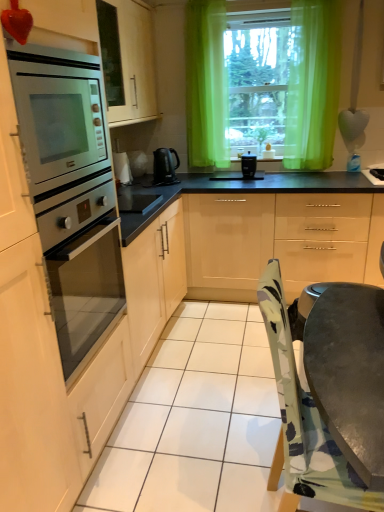
Locate an element on the screen. black plastic kettle at center is located at coordinates (165, 166).

This screenshot has height=512, width=384. Describe the element at coordinates (263, 83) in the screenshot. I see `green sheer curtains at upper center` at that location.

Describe the element at coordinates (279, 241) in the screenshot. I see `glossy beige cabinets at center` at that location.

The width and height of the screenshot is (384, 512). Identify the location of black plastic coffee maker at center. (248, 165).

The height and width of the screenshot is (512, 384). I want to click on black plastic kettle at center, so [x=165, y=166].

In terms of height, does black plastic coffee maker at center look taller or shorter compared to glossy beige cabinets at center?

black plastic coffee maker at center is shorter than glossy beige cabinets at center.

Considering the sizes of objects black plastic coffee maker at center and glossy beige cabinets at center in the image provided, who is wider, black plastic coffee maker at center or glossy beige cabinets at center?

glossy beige cabinets at center is wider.

Between black plastic coffee maker at center and glossy beige cabinets at center, which one appears on the left side from the viewer's perspective?

black plastic coffee maker at center is more to the left.

Is black plastic coffee maker at center looking in the opposite direction of glossy beige cabinets at center?

No, black plastic coffee maker at center is not facing the opposite direction of glossy beige cabinets at center.

At what (x,y) coordinates should I click in order to perform the action: click on home appliance above the glossy beige cabinets at center (from a real-world perspective). Please return your answer as a coordinate pair (x, y). This screenshot has height=512, width=384. Looking at the image, I should click on (165, 166).

Which is behind, glossy beige cabinets at center or black plastic kettle at center?

black plastic kettle at center is more distant.

Which of these two, glossy beige cabinets at center or black plastic kettle at center, is wider?

glossy beige cabinets at center is wider.

Considering the sizes of stainless steel oven at left and black plastic coffee maker at center in the image, is stainless steel oven at left taller or shorter than black plastic coffee maker at center?

Clearly, stainless steel oven at left is taller compared to black plastic coffee maker at center.

Is stainless steel oven at left wider or thinner than black plastic coffee maker at center?

→ Clearly, stainless steel oven at left has more width compared to black plastic coffee maker at center.

From the image's perspective, between stainless steel oven at left and black plastic coffee maker at center, which one is located above?

black plastic coffee maker at center.

Is black plastic coffee maker at center at the back of stainless steel oven at left?

No, stainless steel oven at left's orientation is not away from black plastic coffee maker at center.

Is glossy beige cabinets at center positioned far away from green sheer curtains at upper center?

No, glossy beige cabinets at center is in close proximity to green sheer curtains at upper center.

Measure the distance between glossy beige cabinets at center and green sheer curtains at upper center.

The distance of glossy beige cabinets at center from green sheer curtains at upper center is 32.88 inches.

Between glossy beige cabinets at center and green sheer curtains at upper center, which one appears on the left side from the viewer's perspective?

From the viewer's perspective, green sheer curtains at upper center appears more on the left side.

Considering the sizes of objects glossy beige cabinets at center and green sheer curtains at upper center in the image provided, who is wider, glossy beige cabinets at center or green sheer curtains at upper center?

glossy beige cabinets at center.

From the image's perspective, is black plastic coffee maker at center under green sheer curtains at upper center?

Indeed, from the image's perspective, black plastic coffee maker at center is shown beneath green sheer curtains at upper center.

Is black plastic coffee maker at center positioned beyond the bounds of green sheer curtains at upper center?

black plastic coffee maker at center is positioned outside green sheer curtains at upper center.

Between black plastic coffee maker at center and green sheer curtains at upper center, which one has larger width?

green sheer curtains at upper center.

Where is `window above the black plastic coffee maker at center (from a real-world perspective)`? Image resolution: width=384 pixels, height=512 pixels. window above the black plastic coffee maker at center (from a real-world perspective) is located at coordinates (263, 83).

Is black glass cooktop at center next to black plastic kettle at center and touching it?

No, black glass cooktop at center is not with black plastic kettle at center.

From a real-world perspective, which object stands above the other?

From a 3D spatial view, black plastic kettle at center is above.

Does point (146, 199) come in front of point (168, 162)?

That is True.

Is black glass cooktop at center at the left side of black plastic kettle at center?

Yes.

Can you tell me how much glossy beige cabinets at center and stainless steel oven at left differ in facing direction?

The facing directions of glossy beige cabinets at center and stainless steel oven at left are 91.4 degrees apart.

Is glossy beige cabinets at center not inside stainless steel oven at left?

glossy beige cabinets at center lies outside stainless steel oven at left's area.

Where is `cabinetry that appears behind the stainless steel oven at left`? The image size is (384, 512). cabinetry that appears behind the stainless steel oven at left is located at coordinates (279, 241).

Where is `cabinetry to the right of black plastic coffee maker at center`? cabinetry to the right of black plastic coffee maker at center is located at coordinates (279, 241).

Identify the location of cabinetry located underneath the black plastic kettle at center (from a real-world perspective). (279, 241).

From the image, which object appears to be nearer to green sheer curtains at upper center, stainless steel oven at left or black plastic coffee maker at center?

black plastic coffee maker at center is positioned closer to the anchor green sheer curtains at upper center.

Which object lies further to the anchor point green sheer curtains at upper center, black plastic kettle at center or black glass cooktop at center?

black glass cooktop at center.

Which object lies nearer to the anchor point green sheer curtains at upper center, black glass cooktop at center or stainless steel oven at left?

The object closer to green sheer curtains at upper center is black glass cooktop at center.

Considering their positions, is green sheer curtains at upper center positioned further to black plastic kettle at center than black glass cooktop at center?

The object further to black plastic kettle at center is green sheer curtains at upper center.

Estimate the real-world distances between objects in this image. Which object is closer to black glass cooktop at center, green sheer curtains at upper center or stainless steel oven at left?

The object closer to black glass cooktop at center is stainless steel oven at left.

Considering their positions, is black plastic kettle at center positioned closer to glossy beige cabinets at center than green sheer curtain at upper center?

Among the two, black plastic kettle at center is located nearer to glossy beige cabinets at center.

Considering their positions, is glossy beige cabinets at center positioned closer to green sheer curtains at upper center than stainless steel oven at left?

The object closer to green sheer curtains at upper center is glossy beige cabinets at center.

From the image, which object appears to be nearer to stainless steel oven at left, black plastic kettle at center or black glass cooktop at center?

black glass cooktop at center is positioned closer to the anchor stainless steel oven at left.

Where is `appliance between stainless steel oven at left and black plastic coffee maker at center in the front-back direction`? The width and height of the screenshot is (384, 512). appliance between stainless steel oven at left and black plastic coffee maker at center in the front-back direction is located at coordinates (137, 202).

Where is `cabinetry between black plastic kettle at center and green sheer curtain at upper center in the horizontal direction`? The width and height of the screenshot is (384, 512). cabinetry between black plastic kettle at center and green sheer curtain at upper center in the horizontal direction is located at coordinates (279, 241).

Image resolution: width=384 pixels, height=512 pixels. In order to click on home appliance situated between black glass cooktop at center and glossy beige cabinets at center from left to right in this screenshot , I will do `click(165, 166)`.

Identify the location of appliance between stainless steel oven at left and green sheer curtains at upper center in the front-back direction. (137, 202).